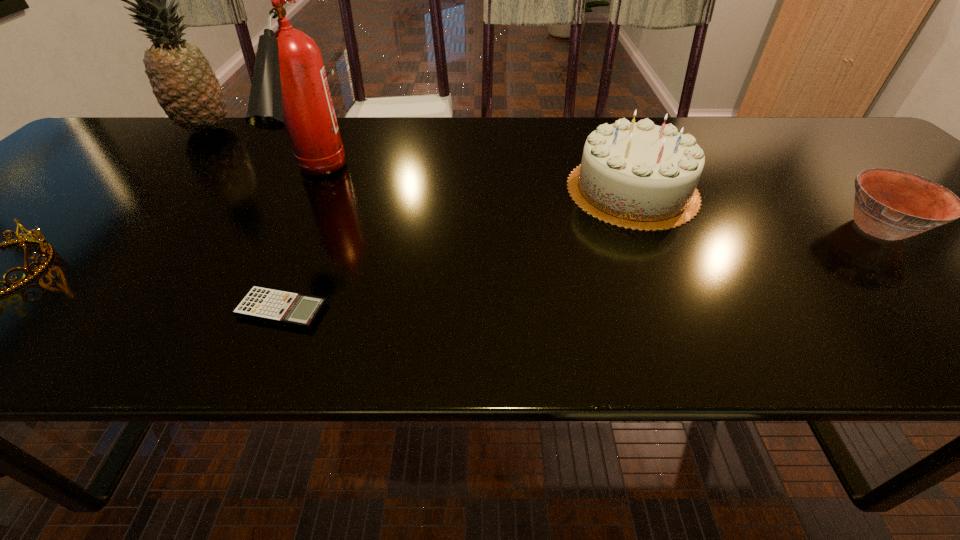
Find the location of a particular element. This screenshot has height=540, width=960. object that ranks as the second closest to the farthest object is located at coordinates (47, 255).

Image resolution: width=960 pixels, height=540 pixels. I want to click on object that is the third closest to the rightmost object, so click(x=289, y=88).

The image size is (960, 540). Find the location of `free region that satisfies the following two spatial constraints: 1. at the nozzle end of the calculator; 2. on the left side of the fire extinguisher`. free region that satisfies the following two spatial constraints: 1. at the nozzle end of the calculator; 2. on the left side of the fire extinguisher is located at coordinates (254, 310).

The height and width of the screenshot is (540, 960). In order to click on free space that satisfies the following two spatial constraints: 1. at the nozzle end of the shortest object; 2. on the left side of the fire extinguisher in this screenshot , I will do `click(254, 310)`.

The width and height of the screenshot is (960, 540). What are the coordinates of `free space that satisfies the following two spatial constraints: 1. on the front side of the pineapple; 2. on the right side of the third tallest object` in the screenshot? It's located at (150, 190).

The width and height of the screenshot is (960, 540). I want to click on free location that satisfies the following two spatial constraints: 1. on the front side of the pineapple; 2. on the left side of the birthday cake, so click(150, 190).